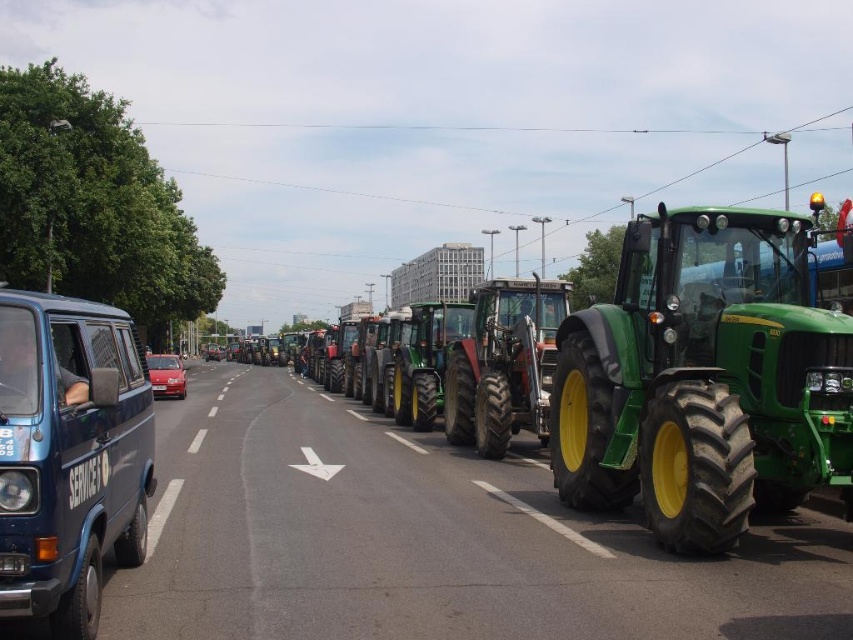
Question: Where is blue matte van at left located in relation to green rubber tractor at center in the image?

Choices:
 (A) above
 (B) below

Answer: (A)

Question: Is green rubber tractor at center wider than white solid line at center?

Choices:
 (A) yes
 (B) no

Answer: (A)

Question: Can you confirm if green matte tractor at center is wider than blue matte van at left?

Choices:
 (A) no
 (B) yes

Answer: (B)

Question: Which of the following is the closest to the observer?

Choices:
 (A) (476, 356)
 (B) (544, 522)
 (C) (664, 525)
 (D) (7, 506)

Answer: (D)

Question: Which is nearer to the green rubber tractor at center?

Choices:
 (A) yellow rubber tire at lower right
 (B) shiny red car at center
 (C) green matte tractor at center

Answer: (C)

Question: Which object is positioned closest to the white solid line at center?

Choices:
 (A) yellow rubber tire at lower right
 (B) green matte tractor at center
 (C) blue matte van at left
 (D) green rubber tractor at center

Answer: (C)